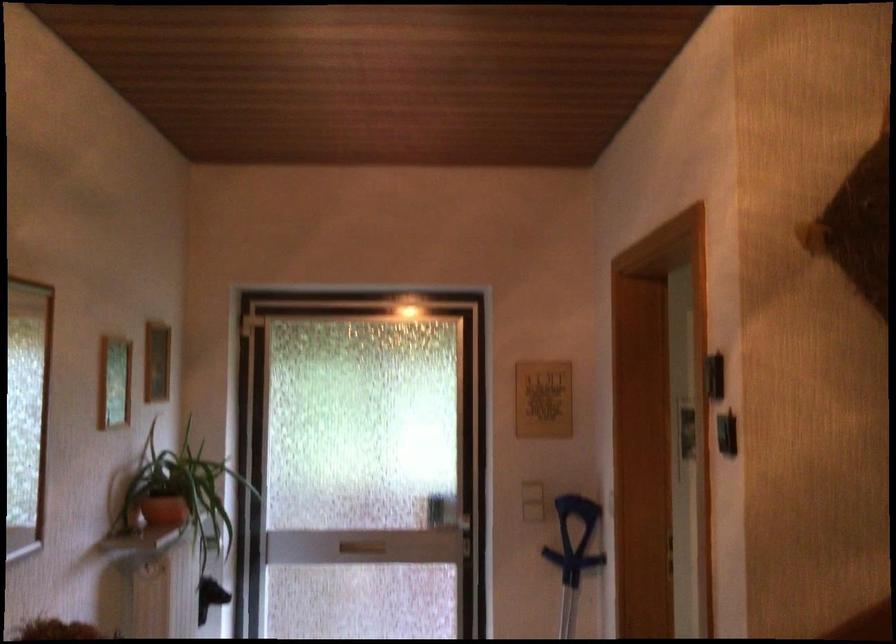
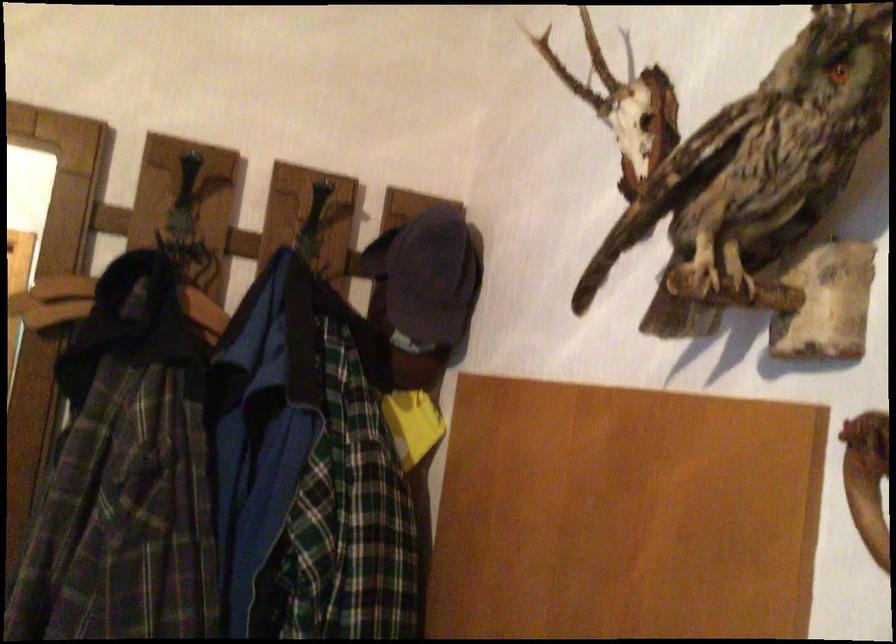
Question: The images are taken continuously from a first-person perspective. In which direction is your viewpoint rotating?

Choices:
 (A) Left
 (B) Right
 (C) Up
 (D) Down

Answer: (B)